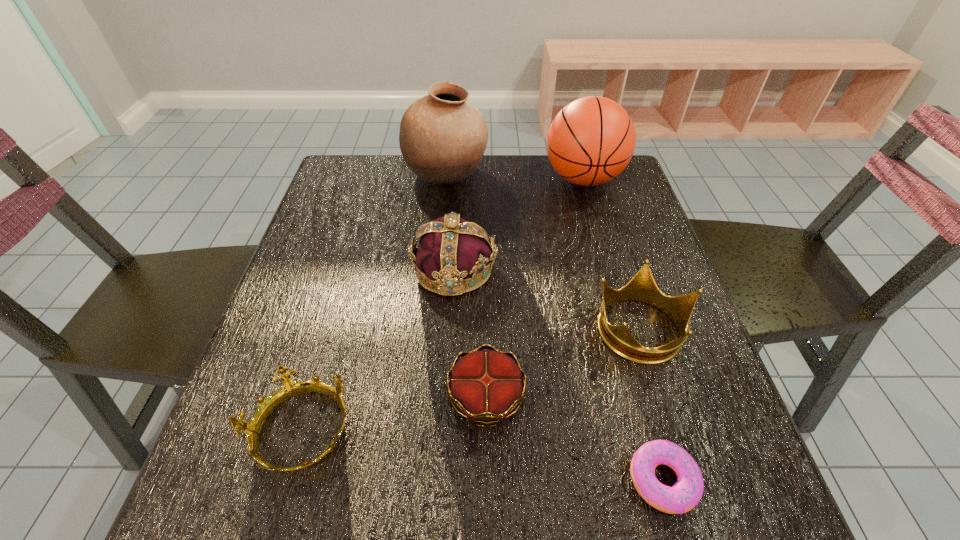
Locate an element on the screen. doughnut positioned at the right edge is located at coordinates (684, 495).

The image size is (960, 540). What are the coordinates of `object that is at the near left corner` in the screenshot? It's located at (290, 388).

Find the location of a particular element. The image size is (960, 540). object situated at the far right corner is located at coordinates (591, 140).

Find the location of `object situated at the near right corner`. object situated at the near right corner is located at coordinates (684, 495).

In order to click on vacant space at the far edge of the desktop in this screenshot , I will do `click(453, 198)`.

Identify the location of vacant space at the near edge. (535, 473).

Where is `vacant space at the left edge of the desktop`? vacant space at the left edge of the desktop is located at coordinates (335, 360).

Find the location of a particular element. This screenshot has height=540, width=960. vacant space at the right edge of the desktop is located at coordinates (667, 282).

Find the location of a particular element. The width and height of the screenshot is (960, 540). vacant region between the fifth shortest object and the leftmost crown is located at coordinates (377, 350).

Where is `vacant area between the pottery and the rightmost crown`? The height and width of the screenshot is (540, 960). vacant area between the pottery and the rightmost crown is located at coordinates (543, 252).